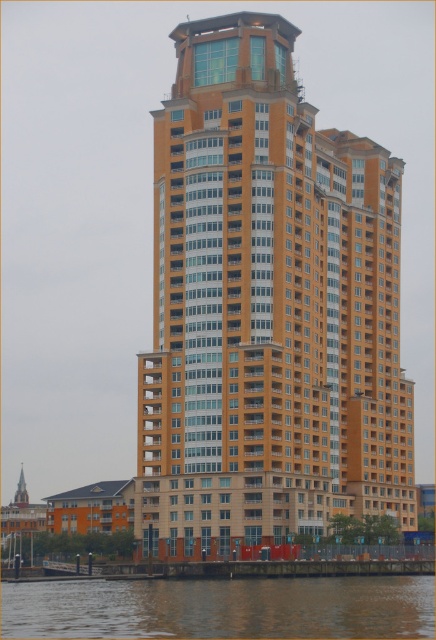
Question: Is orange glassy building at center positioned behind brown water at lower center?

Choices:
 (A) no
 (B) yes

Answer: (B)

Question: Can you confirm if orange glassy building at center is smaller than brown water at lower center?

Choices:
 (A) yes
 (B) no

Answer: (B)

Question: Which of the following is the farthest from the observer?

Choices:
 (A) (389, 630)
 (B) (183, 355)

Answer: (B)

Question: Among these points, which one is nearest to the camera?

Choices:
 (A) (329, 225)
 (B) (348, 580)

Answer: (B)

Question: Which object appears farthest from the camera in this image?

Choices:
 (A) orange glassy building at center
 (B) brown water at lower center

Answer: (A)

Question: Is the position of orange glassy building at center less distant than that of brown water at lower center?

Choices:
 (A) no
 (B) yes

Answer: (A)